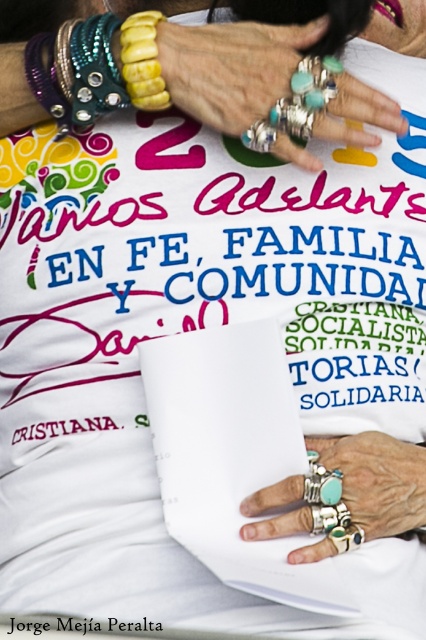
Can you confirm if turquoise stone rings at center is positioned to the right of turquoise silver rings at center?

Incorrect, turquoise stone rings at center is not on the right side of turquoise silver rings at center.

Which is behind, point (270, 65) or point (256, 525)?

Point (270, 65)

Find the location of a particular element. The image size is (426, 640). turquoise stone rings at center is located at coordinates (232, 68).